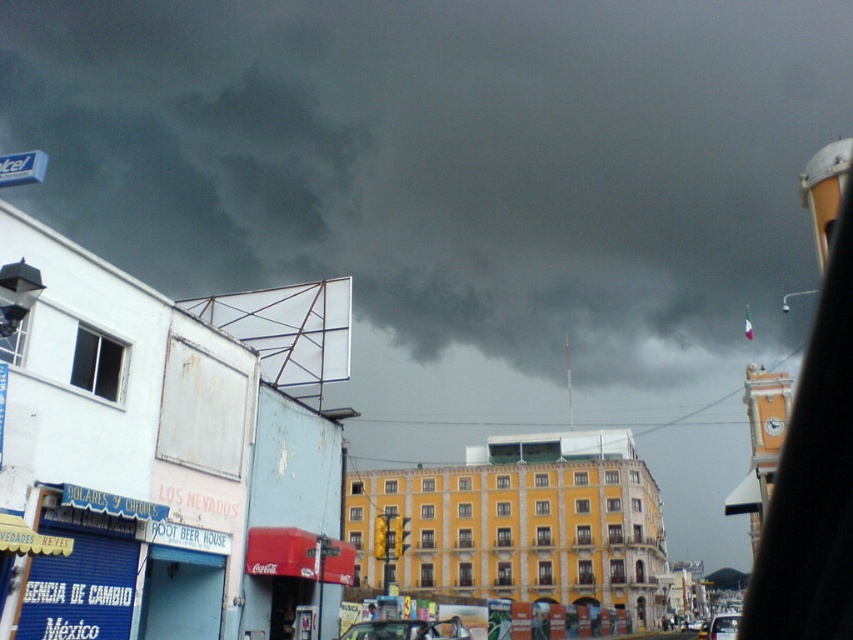
Does clear glass window at center have a greater width compared to metallic blue street sign at upper left?

In fact, clear glass window at center might be narrower than metallic blue street sign at upper left.

This screenshot has height=640, width=853. Describe the element at coordinates (97, 364) in the screenshot. I see `clear glass window at center` at that location.

Who is more forward, (97, 360) or (35, 170)?

Point (35, 170) is more forward.

The height and width of the screenshot is (640, 853). I want to click on clear glass window at center, so click(97, 364).

Can you confirm if metallic clock tower at upper right is smaller than metallic silver car at lower right?

Indeed, metallic clock tower at upper right has a smaller size compared to metallic silver car at lower right.

Which of these two, metallic clock tower at upper right or metallic silver car at lower right, stands taller?

metallic silver car at lower right is taller.

Who is more forward, [780,497] or [730,612]?

Positioned in front is point [780,497].

I want to click on metallic clock tower at upper right, so click(x=813, y=461).

Can you confirm if clear glass window at center is smaller than metallic silver car at center?

Yes.

Is point (85, 340) behind point (375, 634)?

No.

Locate an element on the screen. This screenshot has width=853, height=640. clear glass window at center is located at coordinates (97, 364).